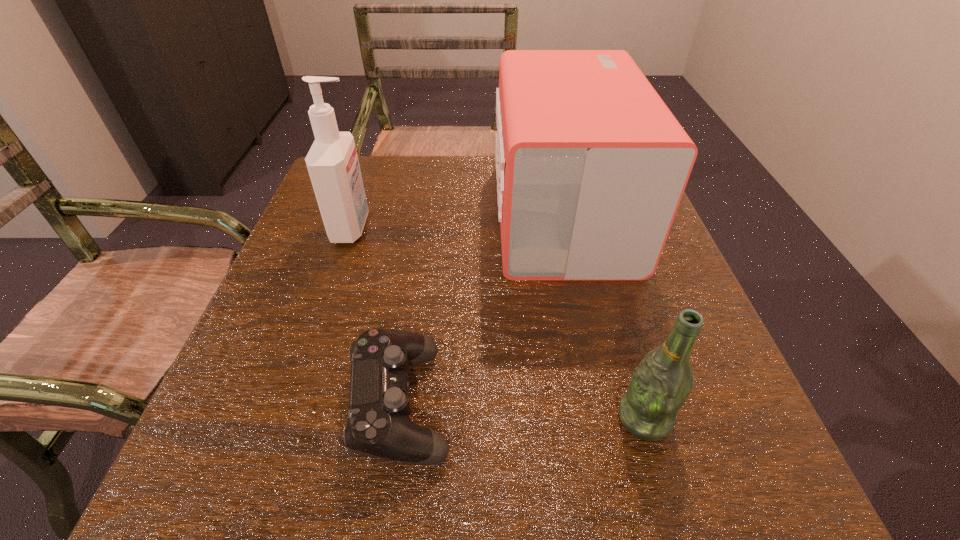
Where is `vacant region between the beer bottle and the shortest object`? Image resolution: width=960 pixels, height=540 pixels. vacant region between the beer bottle and the shortest object is located at coordinates (522, 411).

Locate an element on the screen. vacant area that lies between the box and the cleansing agent is located at coordinates (457, 221).

In order to click on free space between the box and the beer bottle in this screenshot , I will do `click(603, 317)`.

Where is `free space between the box and the control`? free space between the box and the control is located at coordinates (481, 309).

Find the location of a particular element. empty space that is in between the box and the shortest object is located at coordinates (481, 309).

You are a GUI agent. You are given a task and a screenshot of the screen. Output one action in this format:
    pyautogui.click(x=<x>, y=<y>)
    Task: Click on the unoccupied position between the beer bottle and the shortest object
    Image resolution: width=960 pixels, height=540 pixels.
    Given the screenshot: What is the action you would take?
    pyautogui.click(x=522, y=411)

Image resolution: width=960 pixels, height=540 pixels. What are the coordinates of `object that is the closest to the cleansing agent` in the screenshot? It's located at (379, 425).

The height and width of the screenshot is (540, 960). Identify the location of the second closest object to the box. (663, 380).

Locate an element on the screen. The width and height of the screenshot is (960, 540). vacant region that satisfies the following two spatial constraints: 1. on the front label of the cleansing agent; 2. on the right side of the control is located at coordinates (292, 403).

Identify the location of free location that satisfies the following two spatial constraints: 1. on the surface of the box where the text is embossed; 2. on the front side of the third object from right to left. The height and width of the screenshot is (540, 960). (604, 403).